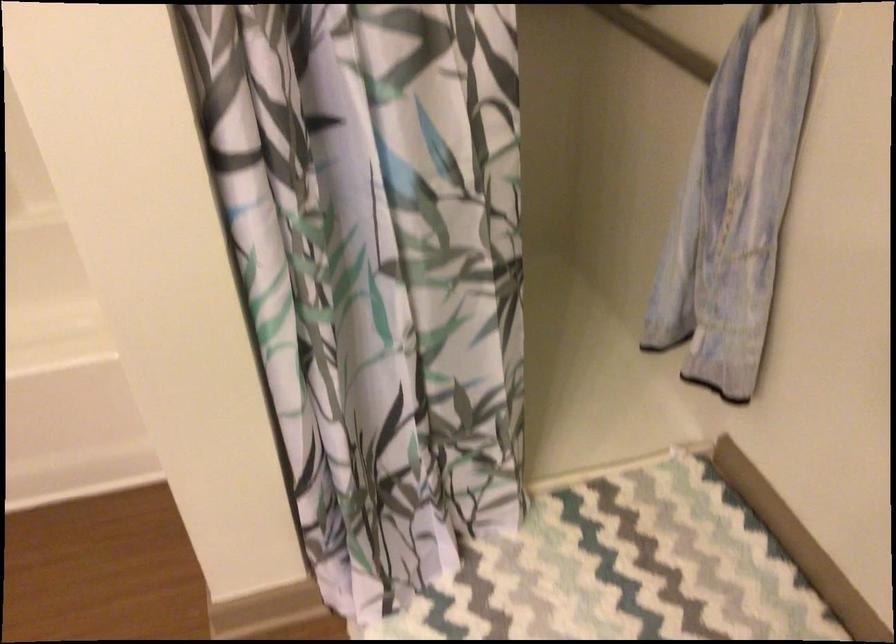
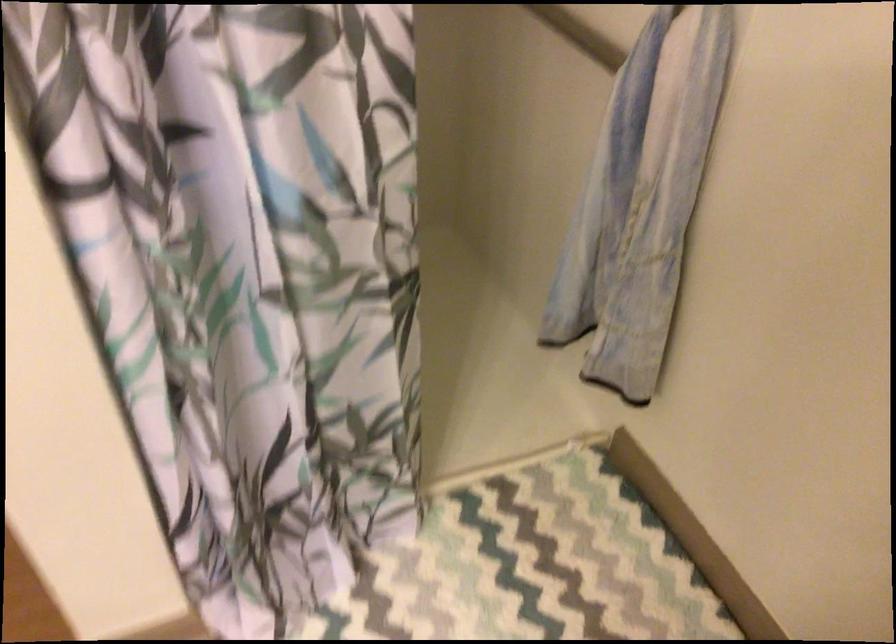
Question: How did the camera likely rotate?

Choices:
 (A) Left
 (B) Right
 (C) Up
 (D) Down

Answer: (B)